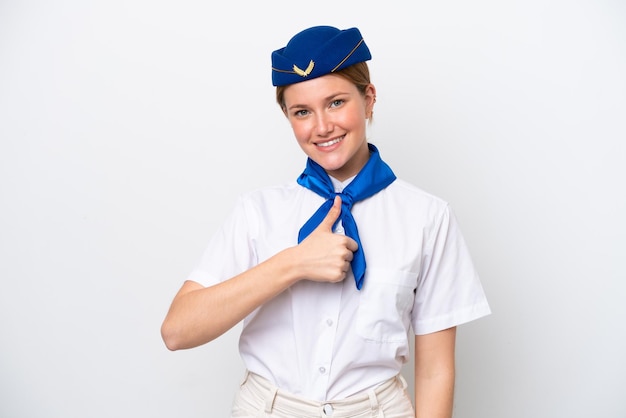
Locate an element on the screen. The height and width of the screenshot is (418, 626). golden trim is located at coordinates (340, 61), (277, 70).